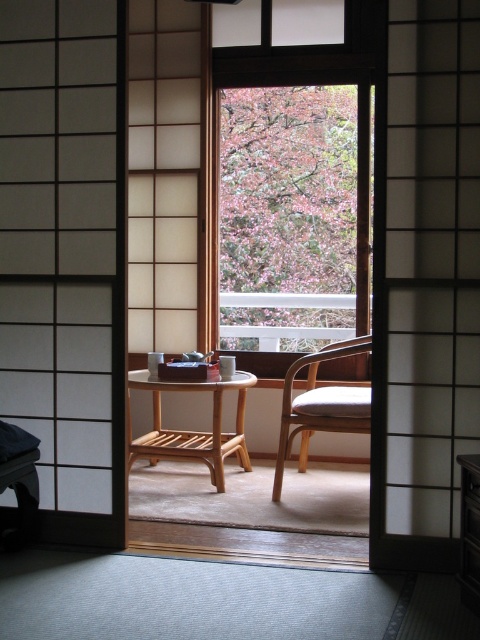
Can you confirm if light brown wooden table at center is positioned above wooden chair at center?

Actually, light brown wooden table at center is below wooden chair at center.

Which is more to the left, light brown wooden table at center or wooden chair at center?

light brown wooden table at center is more to the left.

Who is more forward, [216,480] or [288,387]?

Point [288,387] is more forward.

The width and height of the screenshot is (480, 640). I want to click on light brown wooden table at center, so click(192, 429).

Between transparent glass window at center and wooden chair at center, which one appears on the left side from the viewer's perspective?

From the viewer's perspective, wooden chair at center appears more on the left side.

Does point (322, 54) come closer to viewer compared to point (355, 413)?

That is False.

Is point (220, 83) positioned before point (314, 378)?

No, it is not.

This screenshot has width=480, height=640. What are the coordinates of `transparent glass window at center` in the screenshot? It's located at (320, 84).

Is transparent glass window at center smaller than light brown wooden table at center?

No.

Is transparent glass window at center thinner than light brown wooden table at center?

In fact, transparent glass window at center might be wider than light brown wooden table at center.

Which is in front, point (238, 83) or point (248, 372)?

Positioned in front is point (248, 372).

Where is `transparent glass window at center`? This screenshot has width=480, height=640. transparent glass window at center is located at coordinates (320, 84).